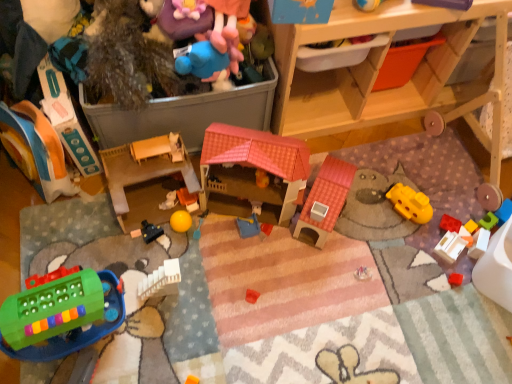
You are a GUI agent. You are given a task and a screenshot of the screen. Output one action in this format:
    pyautogui.click(x=<x>, y=<y>)
    Task: Click on the blank space situated above green plastic building block at lower left, which is the 3th toy in left-to-right order (from a real-world perspective)
    This screenshot has width=512, height=384.
    Given the screenshot: What is the action you would take?
    pyautogui.click(x=47, y=314)